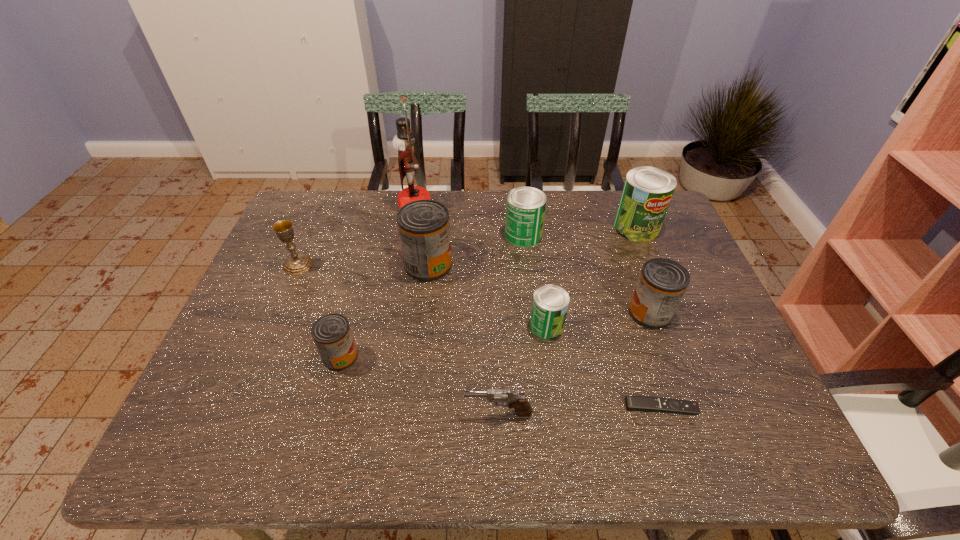
I want to click on vacant space located 0.220m on the back of the second smallest red can, so click(x=626, y=244).

Where is `blank area located 0.220m on the left of the second biggest green can`? This screenshot has height=540, width=960. blank area located 0.220m on the left of the second biggest green can is located at coordinates (434, 235).

I want to click on vacant area situated on the back of the leftmost can, so click(x=362, y=276).

At what (x,y) coordinates should I click in order to perform the action: click on vacant position located 0.260m on the right of the nearest green can. Please return your answer as a coordinate pair (x, y). Looking at the image, I should click on (666, 326).

Where is `blank area located at the barrel of the gray pistol`? blank area located at the barrel of the gray pistol is located at coordinates (321, 413).

Where is `blank area located at the barrel of the gray pistol`? This screenshot has height=540, width=960. blank area located at the barrel of the gray pistol is located at coordinates (325, 413).

This screenshot has height=540, width=960. What are the coordinates of `free region located 0.150m at the barrel of the gray pistol` in the screenshot? It's located at (396, 413).

Identify the location of free space located 0.130m on the left of the remote control. This screenshot has width=960, height=540. (565, 407).

Where is `nutcracker that is at the far edge`? nutcracker that is at the far edge is located at coordinates (404, 141).

What are the coordinates of `object that is at the left edge` in the screenshot? It's located at (297, 263).